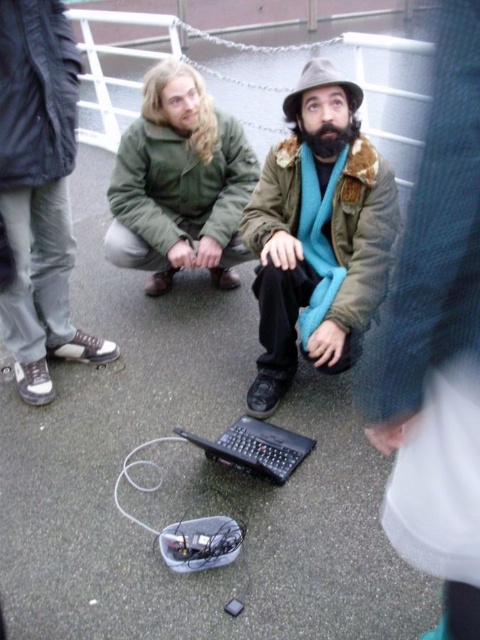
Question: Based on their relative distances, which object is nearer to the green matte jacket at center?

Choices:
 (A) black plastic laptop at center
 (B) matte brown jacket at center

Answer: (B)

Question: Considering the relative positions of black plastic laptop at center and matte brown jacket at center in the image provided, where is black plastic laptop at center located with respect to matte brown jacket at center?

Choices:
 (A) left
 (B) right

Answer: (A)

Question: Is black plastic laptop at center in front of green matte jacket at center?

Choices:
 (A) yes
 (B) no

Answer: (A)

Question: Does black plastic laptop at center lie in front of matte brown jacket at center?

Choices:
 (A) yes
 (B) no

Answer: (A)

Question: Among these points, which one is farthest from the camera?

Choices:
 (A) (249, 408)
 (B) (231, 156)
 (C) (271, 584)

Answer: (B)

Question: Estimate the real-world distances between objects in this image. Which object is closer to the matte brown jacket at center?

Choices:
 (A) black plastic laptop at center
 (B) green matte jacket at center

Answer: (A)